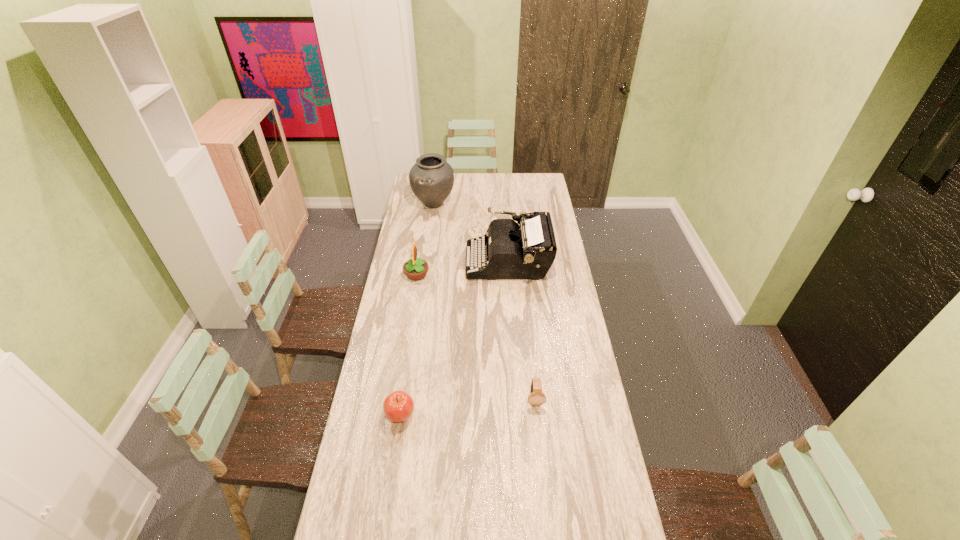
The image size is (960, 540). What are the coordinates of `free space between the sunflower and the urn` in the screenshot? It's located at (425, 239).

The height and width of the screenshot is (540, 960). I want to click on empty space that is in between the third shortest object and the watch, so click(x=475, y=337).

Choose which object is the nearest neighbor to the watch. Please provide its 2D coordinates. Your answer should be formatted as a tuple, i.e. [(x, y)], where the tuple contains the x and y coordinates of a point satisfying the conditions above.

[(398, 406)]

Identify the location of object that is the closest to the watch. This screenshot has height=540, width=960. (398, 406).

This screenshot has width=960, height=540. What are the coordinates of `free location that satisfies the following two spatial constraints: 1. on the face of the third shortest object; 2. on the back side of the apple` in the screenshot? It's located at (394, 415).

Find the location of `free space in the image that satisfies the following two spatial constraints: 1. on the face of the sunflower; 2. on the right side of the apple`. free space in the image that satisfies the following two spatial constraints: 1. on the face of the sunflower; 2. on the right side of the apple is located at coordinates (394, 415).